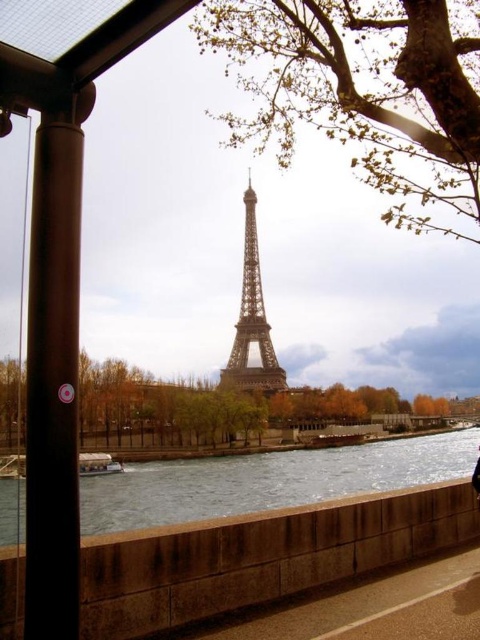
The image size is (480, 640). What are the coordinates of `smooth concrete river at center` in the screenshot? It's located at [x=266, y=481].

What do you see at coordinates (266, 481) in the screenshot? The image size is (480, 640). I see `smooth concrete river at center` at bounding box center [266, 481].

You are a GUI agent. You are given a task and a screenshot of the screen. Output one action in this format:
    pyautogui.click(x=<x>, y=<y>)
    Task: Click on the smooth concrete river at center
    This screenshot has width=480, height=640.
    Given the screenshot: What is the action you would take?
    pyautogui.click(x=266, y=481)

Is point (67, 572) positioned after point (238, 358)?

No, it is not.

Between black polished metal pole at left and shiny metallic eiffel tower at center, which one has more height?

Standing taller between the two is black polished metal pole at left.

Who is more distant from viewer, (54, 422) or (247, 211)?

Point (247, 211)

Locate an element on the screen. The width and height of the screenshot is (480, 640). black polished metal pole at left is located at coordinates (54, 372).

Can you confirm if black polished metal pole at left is thinner than smooth concrete river at center?

Yes.

Is black polished metal pole at left below smooth concrete river at center?

Incorrect, black polished metal pole at left is not positioned below smooth concrete river at center.

Is point (68, 214) farther from camera compared to point (455, 451)?

No, it is in front of (455, 451).

This screenshot has height=640, width=480. Identify the location of black polished metal pole at left. (54, 372).